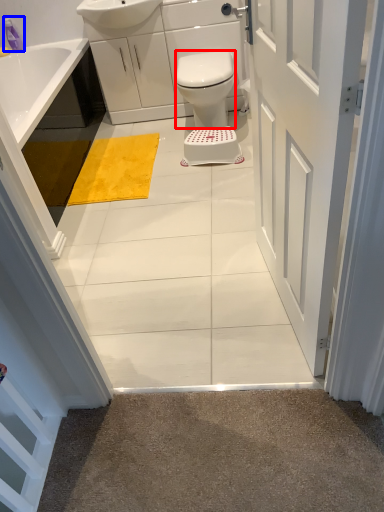
Question: Which object is closer to the camera taking this photo, bidet (highlighted by a red box) or toiletry (highlighted by a blue box)?

Choices:
 (A) bidet
 (B) toiletry

Answer: (A)